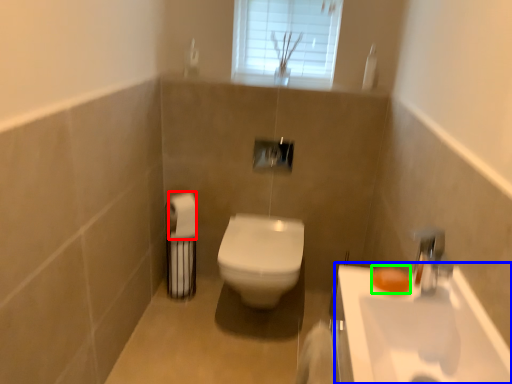
Question: Which is farther away from toilet paper (highlighted by a red box)? sink (highlighted by a blue box) or soap (highlighted by a green box)?

Choices:
 (A) sink
 (B) soap

Answer: (A)